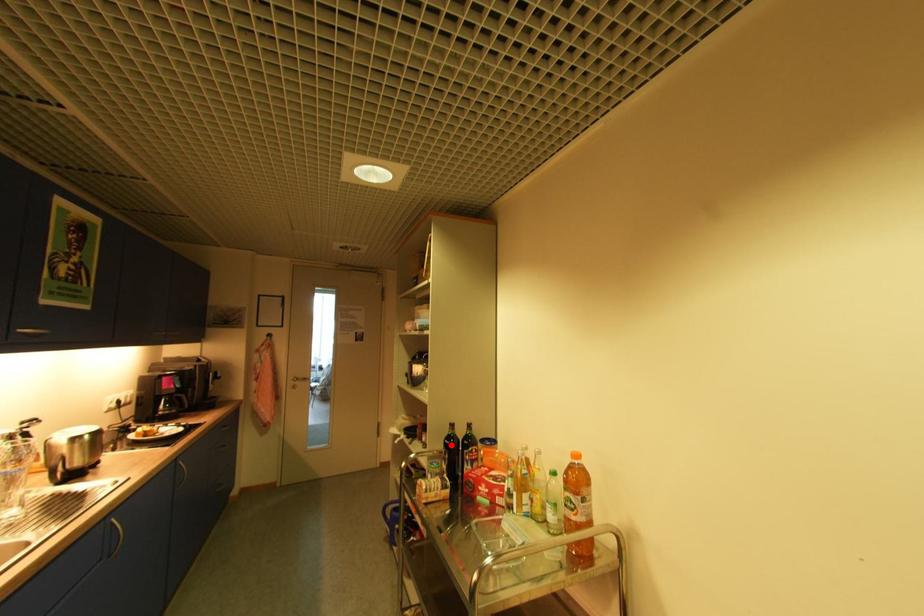
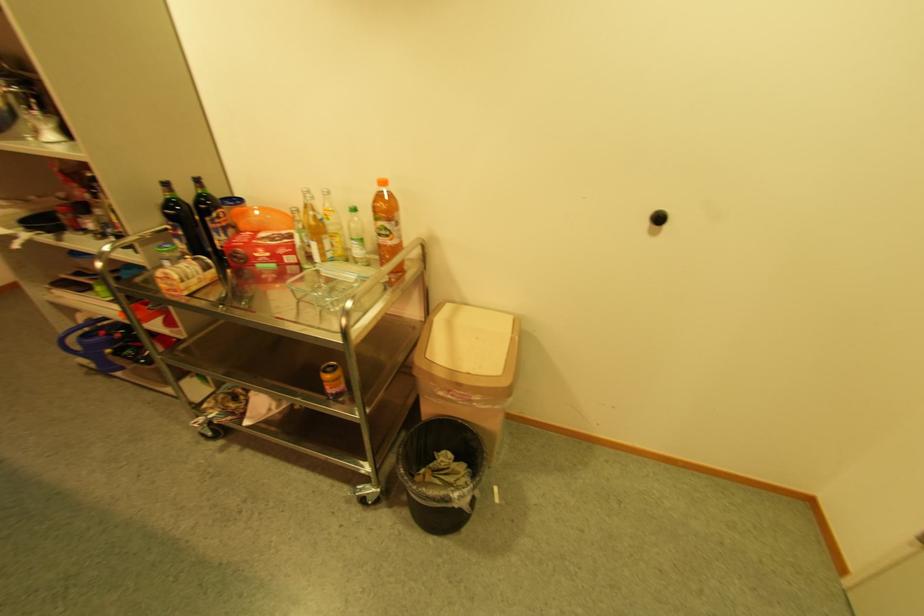
Where in the second image is the point corresponding to the highlighted location from the first image?

(172, 217)